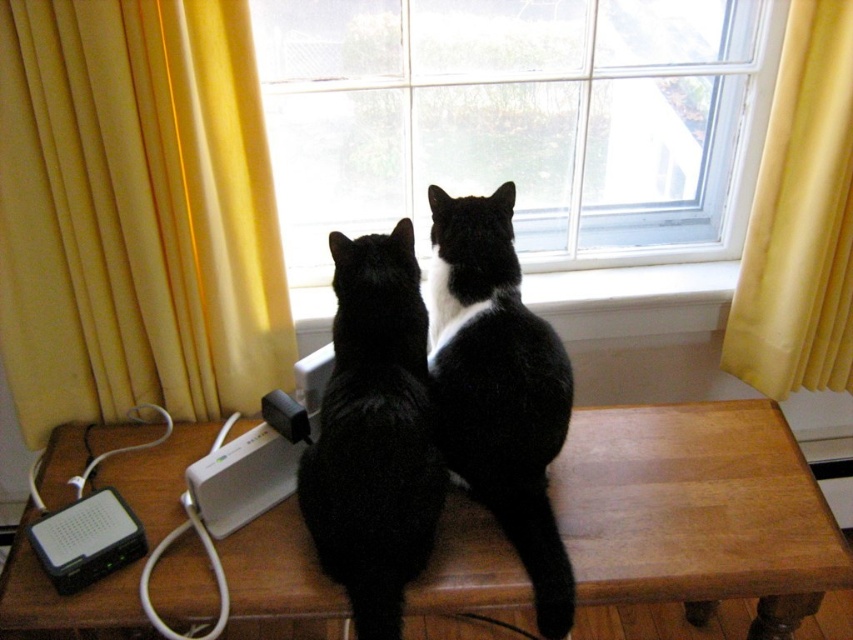
Looking at this image, you are a cat owner who wants to place a new toy between the black fur cat at center and the white smooth window sill at center. Where should you place the toy to ensure it is between them?

The black fur cat at center is positioned on the left side of the white smooth window sill at center, so placing the toy between them would require placing it to the right of the black fur cat at center and to the left of the white smooth window sill at center.

Consider the image. You are a cat owner who wants to let your cat walk through a small door that is 20 cm wide. You see the transparent glass window at center and the black fur cat at center. Can the cat pass through the door?

The transparent glass window at center might be wider than black fur cat at center, so the cat can pass through the 20 cm wide door since the cat is narrower than the door.

You are a cat owner who wants to place a small toy between the two cats on the table. The toy requires at least 6 inches of space to fit. Based on the image, can you determine if there is enough space between the black matte fur cat at center and the black fur cat at center to place the toy?

The black matte fur cat at center is 5.33 inches from black fur cat at center. Since the required space is 6 inches, there is not enough space to place the toy between them.